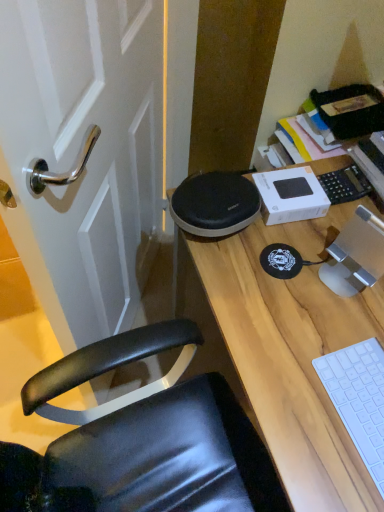
Image resolution: width=384 pixels, height=512 pixels. I want to click on free location above white plastic keyboard at lower right (from a real-world perspective), so click(x=363, y=400).